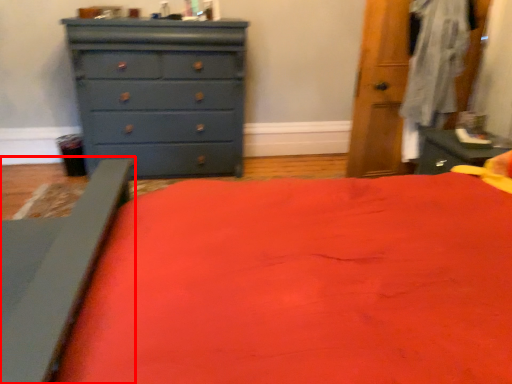
Question: In this image, where is bed frame (annotated by the red box) located relative to chest of drawers?

Choices:
 (A) right
 (B) left

Answer: (B)